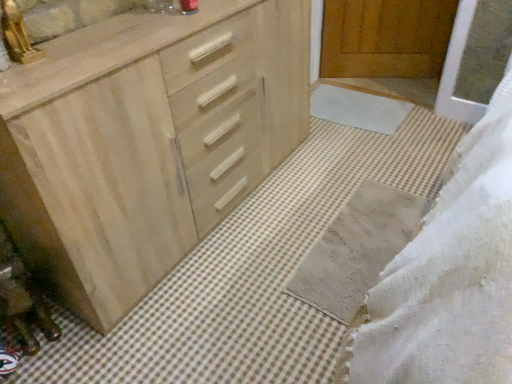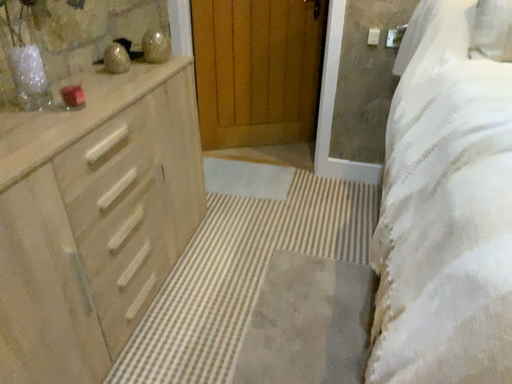
Question: Which way did the camera rotate in the video?

Choices:
 (A) rotated upward
 (B) rotated downward

Answer: (A)